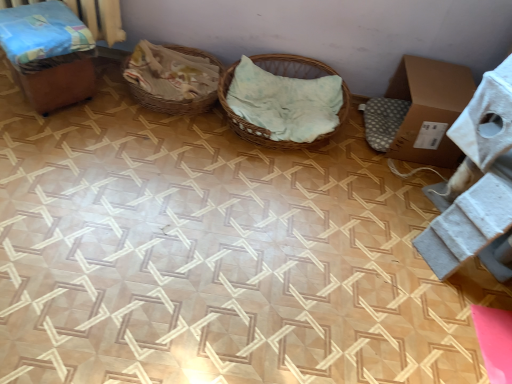
Question: Can you confirm if wooden box at left is smaller than woven wood basket at center, the second basket viewed from the left?

Choices:
 (A) no
 (B) yes

Answer: (B)

Question: Can you confirm if wooden box at left is positioned to the left of woven wood basket at center, positioned as the 1th basket in right-to-left order?

Choices:
 (A) no
 (B) yes

Answer: (B)

Question: Could you tell me if wooden box at left is turned towards woven wood basket at center, positioned as the 1th basket in right-to-left order?

Choices:
 (A) yes
 (B) no

Answer: (B)

Question: Considering the relative sizes of wooden box at left and woven wood basket at center, positioned as the 1th basket in right-to-left order, in the image provided, is wooden box at left thinner than woven wood basket at center, positioned as the 1th basket in right-to-left order,?

Choices:
 (A) yes
 (B) no

Answer: (A)

Question: Does wooden box at left have a greater width compared to woven wood basket at center, positioned as the 1th basket in right-to-left order?

Choices:
 (A) no
 (B) yes

Answer: (A)

Question: Relative to wooden box at left, is woven wood basket at center, the second basket viewed from the left, in front or behind?

Choices:
 (A) behind
 (B) front

Answer: (A)

Question: Visually, is woven wood basket at center, positioned as the 1th basket in right-to-left order, positioned to the left or to the right of wooden box at left?

Choices:
 (A) left
 (B) right

Answer: (B)

Question: In terms of size, does woven wood basket at center, positioned as the 1th basket in right-to-left order, appear bigger or smaller than wooden box at left?

Choices:
 (A) big
 (B) small

Answer: (A)

Question: Is woven wood basket at center, the second basket viewed from the left, spatially inside wooden box at left, or outside of it?

Choices:
 (A) inside
 (B) outside

Answer: (B)

Question: Is wooden box at left situated inside brown cardboard box at right or outside?

Choices:
 (A) outside
 (B) inside

Answer: (A)

Question: Is wooden box at left to the left or to the right of brown cardboard box at right in the image?

Choices:
 (A) right
 (B) left

Answer: (B)

Question: From the image's perspective, relative to brown cardboard box at right, is wooden box at left above or below?

Choices:
 (A) above
 (B) below

Answer: (A)

Question: Based on their sizes in the image, would you say wooden box at left is bigger or smaller than brown cardboard box at right?

Choices:
 (A) big
 (B) small

Answer: (B)

Question: Considering the positions of point (300, 64) and point (421, 157), is point (300, 64) closer or farther from the camera than point (421, 157)?

Choices:
 (A) farther
 (B) closer

Answer: (A)

Question: Would you say woven wood basket at center, the second basket viewed from the left, is inside or outside brown cardboard box at right?

Choices:
 (A) outside
 (B) inside

Answer: (A)